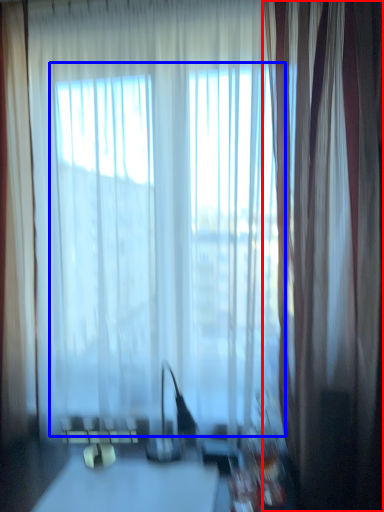
Question: Which point is further to the camera, curtain (highlighted by a red box) or bay window (highlighted by a blue box)?

Choices:
 (A) curtain
 (B) bay window

Answer: (B)